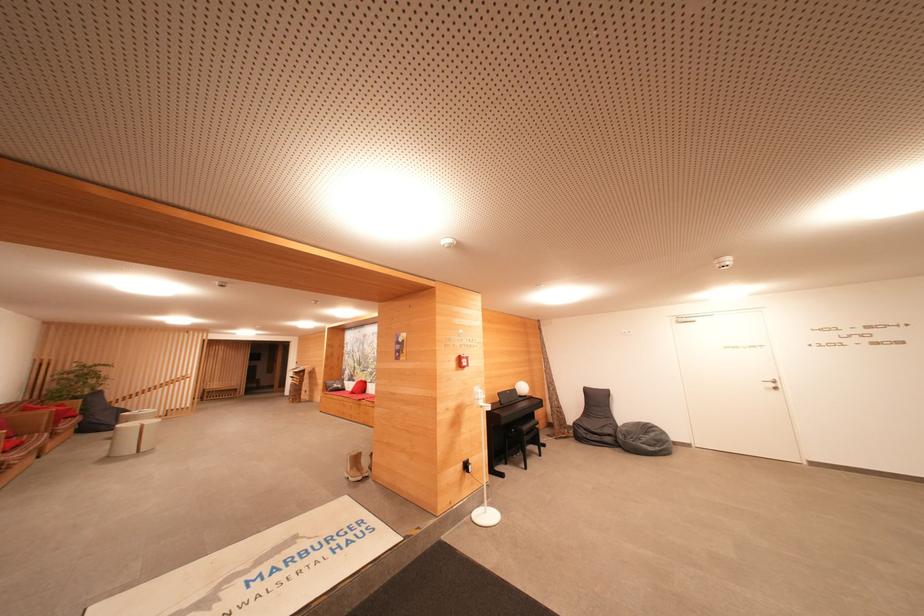
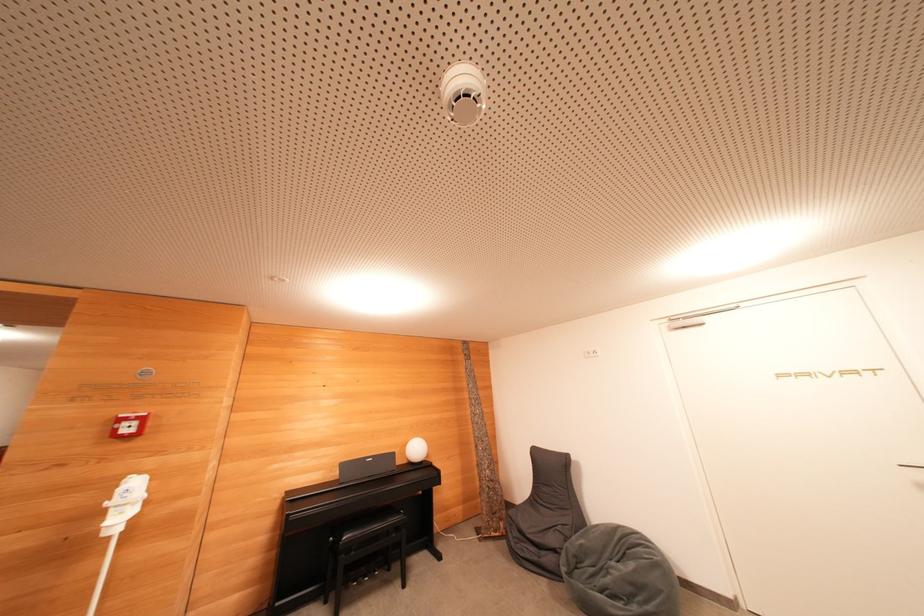
Which direction would the cameraman need to move to produce the second image?

The cameraman moved toward right, forward.